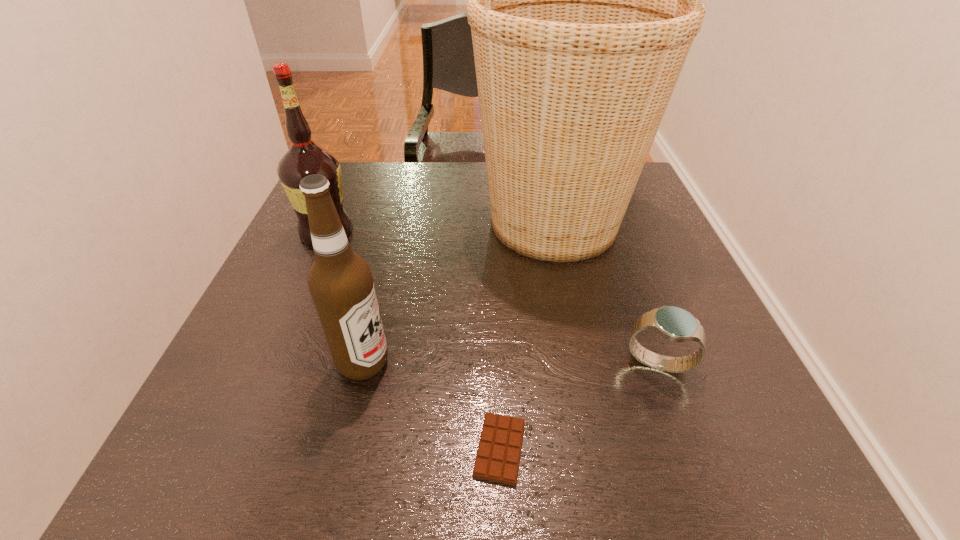
The width and height of the screenshot is (960, 540). I want to click on free area in between the shortest object and the second object from left to right, so click(x=432, y=406).

I want to click on vacant space that is in between the watch and the basket, so click(606, 293).

Locate an element on the screen. Image resolution: width=960 pixels, height=540 pixels. empty space that is in between the basket and the second object from left to right is located at coordinates (459, 293).

Locate which object ranks in proximity to the basket. Please provide its 2D coordinates. Your answer should be formatted as a tuple, i.e. [(x, y)], where the tuple contains the x and y coordinates of a point satisfying the conditions above.

[(673, 323)]

Choose which object is the fourth nearest neighbor to the candy bar. Please provide its 2D coordinates. Your answer should be formatted as a tuple, i.e. [(x, y)], where the tuple contains the x and y coordinates of a point satisfying the conditions above.

[(305, 157)]

Where is `vacant area that satisfies the following two spatial constraints: 1. on the label of the left alcohol; 2. on the left side of the shortest object`? The width and height of the screenshot is (960, 540). vacant area that satisfies the following two spatial constraints: 1. on the label of the left alcohol; 2. on the left side of the shortest object is located at coordinates (232, 449).

Identify the location of free space that satisfies the following two spatial constraints: 1. on the front side of the tallest object; 2. on the label of the leftmost object. Image resolution: width=960 pixels, height=540 pixels. (556, 232).

I want to click on free spot that satisfies the following two spatial constraints: 1. on the label of the second object from left to right; 2. on the left side of the candy bar, so click(x=343, y=449).

Find the location of `blank area in the image that satisfies the following two spatial constraints: 1. on the label of the candy bar; 2. on the left side of the farther alcohol`. blank area in the image that satisfies the following two spatial constraints: 1. on the label of the candy bar; 2. on the left side of the farther alcohol is located at coordinates (232, 449).

You are a GUI agent. You are given a task and a screenshot of the screen. Output one action in this format:
    pyautogui.click(x=<x>, y=<y>)
    Task: Click on the free location that satisfies the following two spatial constraints: 1. on the label of the leftmost object; 2. on the left side of the shortest object
    The width and height of the screenshot is (960, 540).
    Given the screenshot: What is the action you would take?
    pyautogui.click(x=232, y=449)